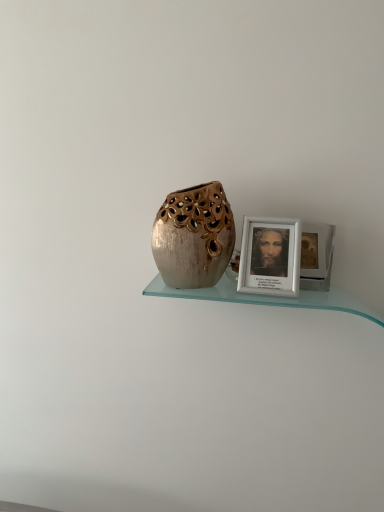
Question: Is white matte picture frame at upper right taller or shorter than shiny metallic vase at center?

Choices:
 (A) tall
 (B) short

Answer: (B)

Question: Is white matte picture frame at upper right spatially inside shiny metallic vase at center, or outside of it?

Choices:
 (A) inside
 (B) outside

Answer: (B)

Question: Would you say white matte picture frame at upper right is to the left or to the right of shiny metallic vase at center in the picture?

Choices:
 (A) right
 (B) left

Answer: (A)

Question: Is shiny metallic vase at center taller or shorter than white matte picture frame at upper right?

Choices:
 (A) tall
 (B) short

Answer: (A)

Question: Is shiny metallic vase at center inside the boundaries of white matte picture frame at upper right, or outside?

Choices:
 (A) outside
 (B) inside

Answer: (A)

Question: Is shiny metallic vase at center bigger or smaller than white matte picture frame at upper right?

Choices:
 (A) small
 (B) big

Answer: (B)

Question: Relative to white matte picture frame at upper right, is shiny metallic vase at center in front or behind?

Choices:
 (A) behind
 (B) front

Answer: (B)